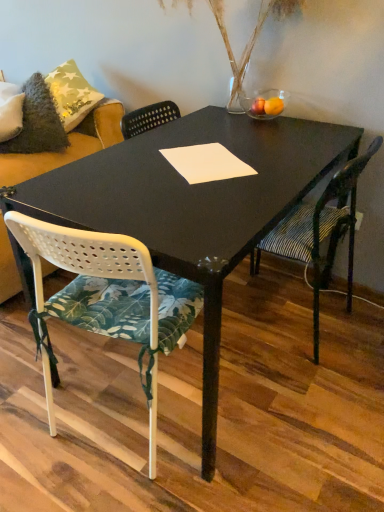
Question: From a real-world perspective, is fuzzy gray pillow at upper left on white paper at center?

Choices:
 (A) no
 (B) yes

Answer: (A)

Question: From the image's perspective, is fuzzy gray pillow at upper left below white paper at center?

Choices:
 (A) no
 (B) yes

Answer: (A)

Question: Is fuzzy gray pillow at upper left oriented towards white paper at center?

Choices:
 (A) yes
 (B) no

Answer: (B)

Question: Does fuzzy gray pillow at upper left appear on the right side of white paper at center?

Choices:
 (A) no
 (B) yes

Answer: (A)

Question: Considering the relative positions of fuzzy gray pillow at upper left and white paper at center in the image provided, is fuzzy gray pillow at upper left in front of white paper at center?

Choices:
 (A) yes
 (B) no

Answer: (B)

Question: Based on their positions, is white paper at center located to the left or right of translucent glass vase at upper center?

Choices:
 (A) left
 (B) right

Answer: (A)

Question: From the image's perspective, is white paper at center above or below translucent glass vase at upper center?

Choices:
 (A) above
 (B) below

Answer: (B)

Question: Considering the positions of white paper at center and translucent glass vase at upper center in the image, is white paper at center taller or shorter than translucent glass vase at upper center?

Choices:
 (A) short
 (B) tall

Answer: (A)

Question: Does point (233, 172) appear closer or farther from the camera than point (284, 13)?

Choices:
 (A) closer
 (B) farther

Answer: (A)

Question: Based on their sizes in the image, would you say fuzzy gray pillow at upper left is bigger or smaller than translucent glass vase at upper center?

Choices:
 (A) big
 (B) small

Answer: (B)

Question: Based on their positions, is fuzzy gray pillow at upper left located to the left or right of translucent glass vase at upper center?

Choices:
 (A) right
 (B) left

Answer: (B)

Question: Considering the positions of fuzzy gray pillow at upper left and translucent glass vase at upper center in the image, is fuzzy gray pillow at upper left wider or thinner than translucent glass vase at upper center?

Choices:
 (A) wide
 (B) thin

Answer: (B)

Question: From the image's perspective, is fuzzy gray pillow at upper left positioned above or below translucent glass vase at upper center?

Choices:
 (A) below
 (B) above

Answer: (A)

Question: In terms of size, does white paper at center appear bigger or smaller than striped fabric chair at right, the second chair when ordered from left to right?

Choices:
 (A) big
 (B) small

Answer: (B)

Question: From a real-world perspective, is white paper at center above or below striped fabric chair at right, which appears as the 1th chair when viewed from the right?

Choices:
 (A) below
 (B) above

Answer: (B)